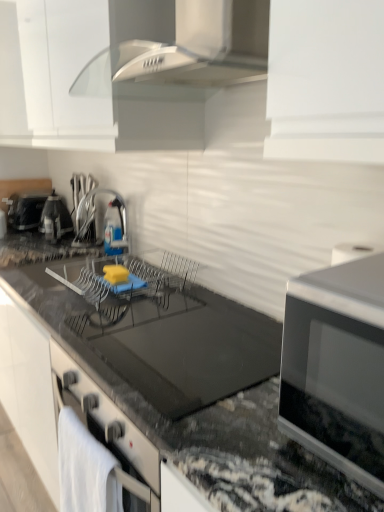
Question: Does metallic silver kettle at left, which ranks as the second appliance in front-to-back order, have a lesser height compared to satin nickel faucet at center, which is the third appliance in back-to-front order?

Choices:
 (A) yes
 (B) no

Answer: (A)

Question: Does metallic silver kettle at left, the 2th appliance when ordered from back to front, appear on the right side of satin nickel faucet at center, placed as the 3th appliance when sorted from left to right?

Choices:
 (A) no
 (B) yes

Answer: (A)

Question: From a real-world perspective, is metallic silver kettle at left, the 2th appliance when ordered from back to front, below satin nickel faucet at center, acting as the first appliance starting from the right?

Choices:
 (A) yes
 (B) no

Answer: (A)

Question: Does metallic silver kettle at left, the 2th appliance viewed from the left, have a larger size compared to satin nickel faucet at center, which is the third appliance in back-to-front order?

Choices:
 (A) no
 (B) yes

Answer: (B)

Question: Is metallic silver kettle at left, which ranks as the second appliance in front-to-back order, wider than satin nickel faucet at center, acting as the first appliance starting from the right?

Choices:
 (A) no
 (B) yes

Answer: (A)

Question: Is black glass countertop at center in front of or behind silver metallic microwave at right in the image?

Choices:
 (A) behind
 (B) front

Answer: (A)

Question: In terms of size, does black glass countertop at center appear bigger or smaller than silver metallic microwave at right?

Choices:
 (A) big
 (B) small

Answer: (A)

Question: Considering the positions of black glass countertop at center and silver metallic microwave at right in the image, is black glass countertop at center taller or shorter than silver metallic microwave at right?

Choices:
 (A) tall
 (B) short

Answer: (A)

Question: From a real-world perspective, is black glass countertop at center above or below silver metallic microwave at right?

Choices:
 (A) below
 (B) above

Answer: (A)

Question: In terms of width, does transparent plastic bottle at center look wider or thinner when compared to silver metallic microwave at right?

Choices:
 (A) thin
 (B) wide

Answer: (A)

Question: Based on their sizes in the image, would you say transparent plastic bottle at center is bigger or smaller than silver metallic microwave at right?

Choices:
 (A) big
 (B) small

Answer: (B)

Question: From the image's perspective, relative to silver metallic microwave at right, is transparent plastic bottle at center above or below?

Choices:
 (A) above
 (B) below

Answer: (A)

Question: In the image, is transparent plastic bottle at center positioned in front of or behind silver metallic microwave at right?

Choices:
 (A) behind
 (B) front

Answer: (A)

Question: From the image's perspective, is satin nickel faucet at center, acting as the first appliance starting from the right, above or below transparent plastic bottle at center?

Choices:
 (A) above
 (B) below

Answer: (B)

Question: Is satin nickel faucet at center, placed as the 3th appliance when sorted from left to right, inside or outside of transparent plastic bottle at center?

Choices:
 (A) inside
 (B) outside

Answer: (B)